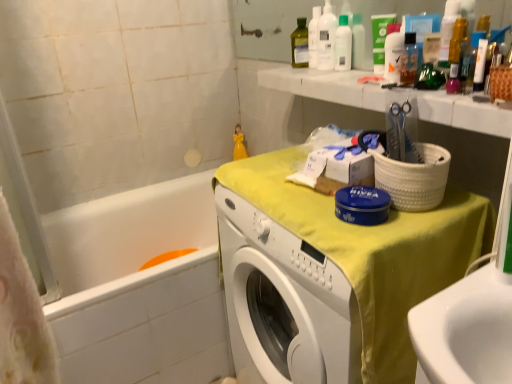
Describe the element at coordinates (373, 250) in the screenshot. The image size is (512, 384). I see `yellow fabric-covered washer at center` at that location.

The image size is (512, 384). What do you see at coordinates (325, 86) in the screenshot?
I see `white marble counter top at upper right` at bounding box center [325, 86].

Describe the element at coordinates (343, 45) in the screenshot. This screenshot has height=384, width=512. I see `clear plastic bottle at upper center` at that location.

The image size is (512, 384). Identify the location of clear plastic bottle at upper center. [x=343, y=45].

Measure the distance between point (374, 42) and camera.

Point (374, 42) and camera are 1.26 meters apart from each other.

Describe the element at coordinates (139, 286) in the screenshot. Image resolution: width=512 pixels, height=384 pixels. I see `white glossy bathtub at lower left` at that location.

Image resolution: width=512 pixels, height=384 pixels. Describe the element at coordinates (326, 38) in the screenshot. I see `white plastic bottles at upper center, which ranks as the first cleaning product in left-to-right order` at that location.

Describe the element at coordinates (313, 36) in the screenshot. I see `white plastic bottle at upper center` at that location.

Where is `white plastic bottle at upper center`? white plastic bottle at upper center is located at coordinates (313, 36).

In order to click on yellow fabric-covered washer at center in this screenshot , I will do `click(373, 250)`.

Which object is positioned more to the left, green matte tube at upper center or white glossy bottle at upper center, which is the second cleaning product in left-to-right order?

Positioned to the left is green matte tube at upper center.

Is point (380, 29) closer or farther from the camera than point (388, 69)?

Point (380, 29) is farther from the camera than point (388, 69).

Do you think green matte tube at upper center is within white glossy bottle at upper center, the first cleaning product in the front-to-back sequence, or outside of it?

green matte tube at upper center is not inside white glossy bottle at upper center, the first cleaning product in the front-to-back sequence, it's outside.

Is green matte tube at upper center further to the viewer compared to white glossy bottle at upper center, the 1th cleaning product positioned from the right?

Yes, green matte tube at upper center is further from the viewer.

Based on their positions, is white glossy bottle at upper center, which is the second cleaning product in left-to-right order, located to the left or right of white marble counter top at upper right?

In the image, white glossy bottle at upper center, which is the second cleaning product in left-to-right order, appears on the right side of white marble counter top at upper right.

Is white glossy bottle at upper center, the first cleaning product in the front-to-back sequence, oriented towards white marble counter top at upper right?

No, white glossy bottle at upper center, the first cleaning product in the front-to-back sequence, is not oriented towards white marble counter top at upper right.

Where is `counter top in front of the white glossy bottle at upper center, the 1th cleaning product positioned from the right`? counter top in front of the white glossy bottle at upper center, the 1th cleaning product positioned from the right is located at coordinates tap(325, 86).

From the image's perspective, which is above, white glossy bathtub at lower left or white marble counter top at upper right?

white marble counter top at upper right.

Does white glossy bathtub at lower left have a lesser height compared to white marble counter top at upper right?

Incorrect, the height of white glossy bathtub at lower left does not fall short of that of white marble counter top at upper right.

Based on the photo, which is behind, white glossy bathtub at lower left or white marble counter top at upper right?

white glossy bathtub at lower left is behind.

At what (x,y) coordinates should I click in order to perform the action: click on counter top above the white glossy bathtub at lower left (from the image's perspective). Please return your answer as a coordinate pair (x, y). Looking at the image, I should click on (325, 86).

Does white marble counter top at upper right have a larger size compared to yellow fabric-covered washer at center?

Incorrect, white marble counter top at upper right is not larger than yellow fabric-covered washer at center.

Between white marble counter top at upper right and yellow fabric-covered washer at center, which one has less height?

white marble counter top at upper right is shorter.

Considering the positions of objects white marble counter top at upper right and yellow fabric-covered washer at center in the image provided, who is more to the left, white marble counter top at upper right or yellow fabric-covered washer at center?

Positioned to the left is yellow fabric-covered washer at center.

Is yellow fabric-covered washer at center at the back of white marble counter top at upper right?

That's not correct — white marble counter top at upper right is not looking away from yellow fabric-covered washer at center.

Is clear plastic bottle at upper center turned away from white glossy bottle at upper center, which ranks as the 2th cleaning product in back-to-front order?

No, white glossy bottle at upper center, which ranks as the 2th cleaning product in back-to-front order, is not at the back of clear plastic bottle at upper center.

Considering the relative positions of clear plastic bottle at upper center and white glossy bottle at upper center, the first cleaning product in the front-to-back sequence, in the image provided, is clear plastic bottle at upper center to the left of white glossy bottle at upper center, the first cleaning product in the front-to-back sequence, from the viewer's perspective?

Yes, clear plastic bottle at upper center is to the left of white glossy bottle at upper center, the first cleaning product in the front-to-back sequence.

At what (x,y) coordinates should I click in order to perform the action: click on mouthwash located behind the white glossy bottle at upper center, the first cleaning product in the front-to-back sequence. Please return your answer as a coordinate pair (x, y). Image resolution: width=512 pixels, height=384 pixels. Looking at the image, I should click on (343, 45).

In the scene shown: Who is shorter, clear plastic bottle at upper center or white glossy bottle at upper center, the first cleaning product in the front-to-back sequence?

white glossy bottle at upper center, the first cleaning product in the front-to-back sequence, is shorter.

Is white plastic bottles at upper center, which ranks as the 1th cleaning product in back-to-front order, facing away from yellow fabric-covered washer at center?

No, white plastic bottles at upper center, which ranks as the 1th cleaning product in back-to-front order, is not facing away from yellow fabric-covered washer at center.

Is white plastic bottles at upper center, which ranks as the first cleaning product in left-to-right order, at the right side of yellow fabric-covered washer at center?

No.

From a real-world perspective, which is physically below, white plastic bottles at upper center, which ranks as the first cleaning product in left-to-right order, or yellow fabric-covered washer at center?

yellow fabric-covered washer at center is physically lower.

From the image's perspective, is white plastic bottles at upper center, which ranks as the 1th cleaning product in back-to-front order, on yellow fabric-covered washer at center?

Indeed, from the image's perspective, white plastic bottles at upper center, which ranks as the 1th cleaning product in back-to-front order, is shown above yellow fabric-covered washer at center.

Based on the photo, from the image's perspective, is green matte tube at upper center below white glossy bathtub at lower left?

No, from the image's perspective, green matte tube at upper center is not beneath white glossy bathtub at lower left.

Between green matte tube at upper center and white glossy bathtub at lower left, which one appears on the right side from the viewer's perspective?

green matte tube at upper center.

Are green matte tube at upper center and white glossy bathtub at lower left making contact?

green matte tube at upper center and white glossy bathtub at lower left are not in contact.

Would you say green matte tube at upper center is outside white glossy bathtub at lower left?

Yes, green matte tube at upper center is not within white glossy bathtub at lower left.

This screenshot has width=512, height=384. I want to click on cleaning product below the green matte tube at upper center (from a real-world perspective), so click(393, 53).

Where is `cleaning product that appears on the right of white marble counter top at upper right`? Image resolution: width=512 pixels, height=384 pixels. cleaning product that appears on the right of white marble counter top at upper right is located at coordinates (393, 53).

From the image, which object appears to be nearer to green matte tube at upper center, white marble counter top at upper right or white plastic bottles at upper center, which ranks as the first cleaning product in left-to-right order?

white plastic bottles at upper center, which ranks as the first cleaning product in left-to-right order, lies closer to green matte tube at upper center than the other object.

Estimate the real-world distances between objects in this image. Which object is closer to white plastic bottles at upper center, which ranks as the first cleaning product in left-to-right order, yellow fabric-covered washer at center or white plastic bottle at upper center?

Among the two, white plastic bottle at upper center is located nearer to white plastic bottles at upper center, which ranks as the first cleaning product in left-to-right order.

From the image, which object appears to be farther from white marble counter top at upper right, green matte tube at upper center or white glossy bathtub at lower left?

white glossy bathtub at lower left.

Looking at the image, which one is located further to white marble counter top at upper right, clear plastic bottle at upper center or white glossy bathtub at lower left?

white glossy bathtub at lower left.

When comparing their distances from yellow fabric-covered washer at center, does white plastic bottle at upper center or clear plastic bottle at upper center seem further?

white plastic bottle at upper center is positioned further to the anchor yellow fabric-covered washer at center.

Estimate the real-world distances between objects in this image. Which object is closer to white marble counter top at upper right, white glossy bathtub at lower left or white plastic bottle at upper center?

white plastic bottle at upper center is positioned closer to the anchor white marble counter top at upper right.

When comparing their distances from white marble counter top at upper right, does yellow fabric-covered washer at center or white glossy bathtub at lower left seem closer?

yellow fabric-covered washer at center is positioned closer to the anchor white marble counter top at upper right.

When comparing their distances from white glossy bathtub at lower left, does green matte tube at upper center or white plastic bottle at upper center seem closer?

white plastic bottle at upper center is positioned closer to the anchor white glossy bathtub at lower left.

Where is `counter top between clear plastic bottle at upper center and white glossy bathtub at lower left vertically`? Image resolution: width=512 pixels, height=384 pixels. counter top between clear plastic bottle at upper center and white glossy bathtub at lower left vertically is located at coordinates (325, 86).

Identify the location of mouthwash positioned between green matte tube at upper center and white plastic bottle at upper center from near to far. (343, 45).

I want to click on mouthwash that lies between white plastic bottle at upper center and white glossy bathtub at lower left from top to bottom, so click(343, 45).

Find the location of a particular element. The height and width of the screenshot is (384, 512). toiletry between white plastic bottles at upper center, which ranks as the first cleaning product in left-to-right order, and white glossy bathtub at lower left, in the vertical direction is located at coordinates (380, 39).